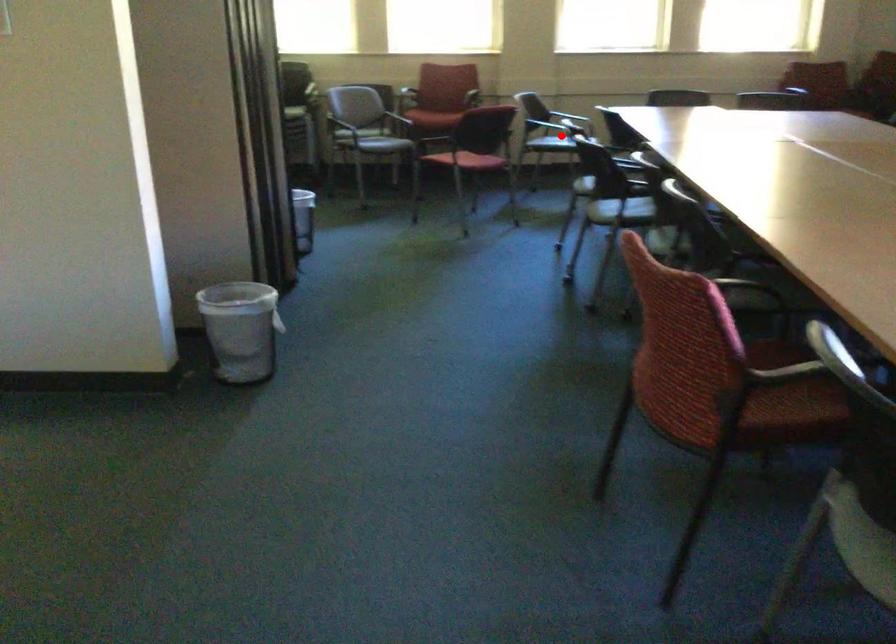
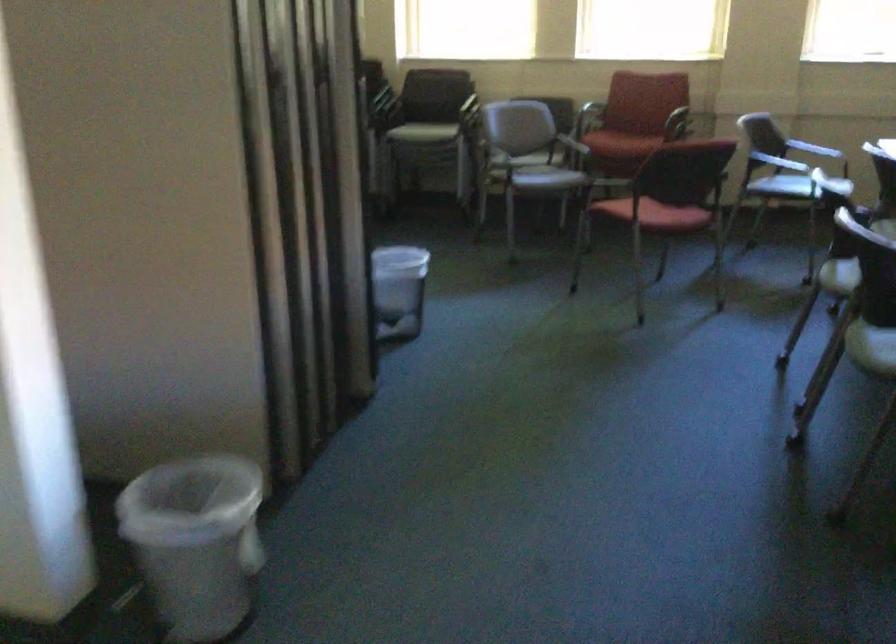
Question: A red point is marked in image1. In image2, is the corresponding 3D point closer to the camera or farther? Reply with the corresponding letter.

Choices:
 (A) The corresponding 3D point is closer.
 (B) The corresponding 3D point is farther.

Answer: (A)